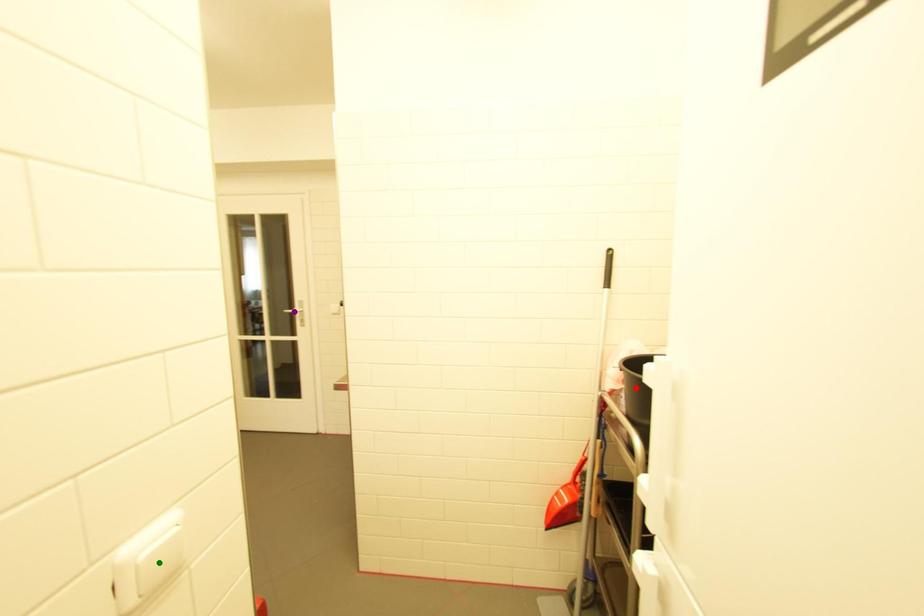
Order these from nearest to farthest:
- red point
- purple point
- green point

purple point
red point
green point